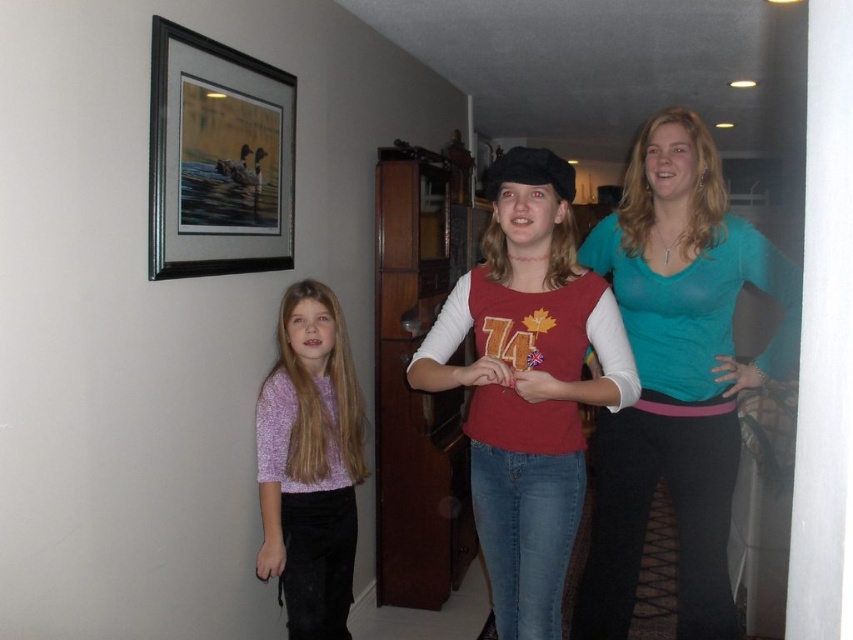
Question: Which of the following is the closest to the observer?

Choices:
 (A) teal jersey at center
 (B) matte red shirt at center
 (C) black framed picture at upper left
 (D) purple knit sweater at left

Answer: (B)

Question: Can you confirm if teal jersey at center is bigger than black framed picture at upper left?

Choices:
 (A) no
 (B) yes

Answer: (B)

Question: Is matte red shirt at center bigger than purple knit sweater at left?

Choices:
 (A) no
 (B) yes

Answer: (B)

Question: Estimate the real-world distances between objects in this image. Which object is closer to the purple knit sweater at left?

Choices:
 (A) matte red shirt at center
 (B) black framed picture at upper left
 (C) teal jersey at center

Answer: (B)

Question: In this image, where is black framed picture at upper left located relative to purple knit sweater at left?

Choices:
 (A) left
 (B) right

Answer: (A)

Question: Estimate the real-world distances between objects in this image. Which object is closer to the matte red shirt at center?

Choices:
 (A) teal jersey at center
 (B) purple knit sweater at left
 (C) black framed picture at upper left

Answer: (A)